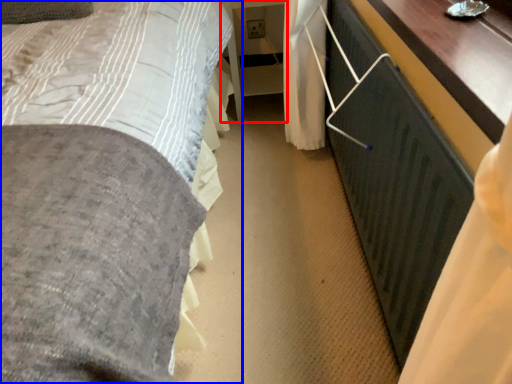
Question: Which object appears farthest to the camera in this image, table (highlighted by a red box) or bed (highlighted by a blue box)?

Choices:
 (A) table
 (B) bed

Answer: (A)